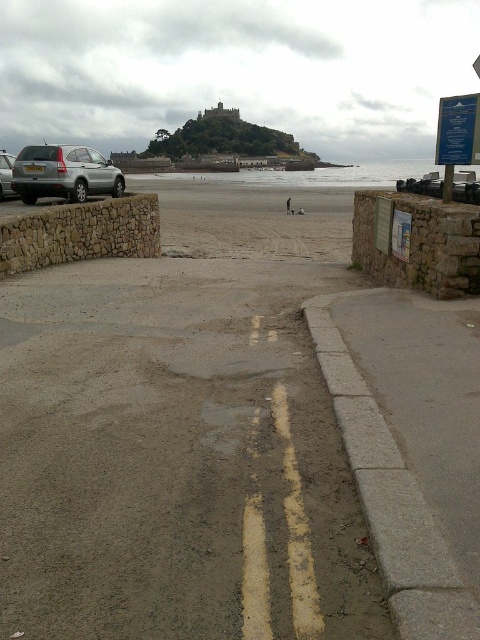
How much distance is there between satin silver suv at left and silver metallic car at left?

satin silver suv at left and silver metallic car at left are 5.18 feet apart from each other.

Does satin silver suv at left appear under silver metallic car at left?

Yes.

Locate an element on the screen. The width and height of the screenshot is (480, 640). satin silver suv at left is located at coordinates (63, 173).

Between smooth sand beach at center and gray concrete curb at lower right, which one appears on the left side from the viewer's perspective?

smooth sand beach at center is more to the left.

Does point (122, 604) come closer to viewer compared to point (364, 442)?

Yes, it is.

Is point (349, 202) closer to viewer compared to point (444, 545)?

That is False.

The height and width of the screenshot is (640, 480). In order to click on smooth sand beach at center in this screenshot , I will do `click(228, 432)`.

How far apart are smooth sand beach at center and blue plastic sign at upper right?

They are 11.91 meters apart.

Can you confirm if smooth sand beach at center is positioned below blue plastic sign at upper right?

Indeed, smooth sand beach at center is positioned under blue plastic sign at upper right.

Identify the location of smooth sand beach at center. (228, 432).

Find the location of a particular element. This screenshot has width=480, height=640. smooth sand beach at center is located at coordinates (228, 432).